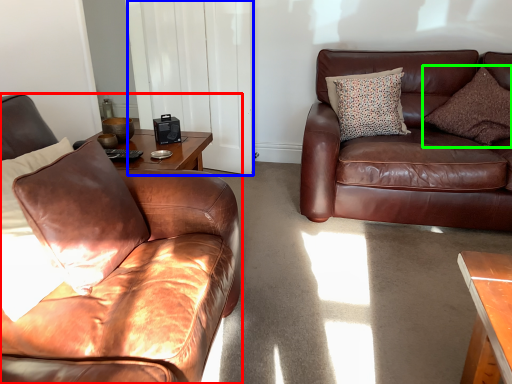
Question: Estimate the real-world distances between objects in this image. Which object is closer to studio couch (highlighted by a red box), glass door (highlighted by a blue box) or pillow (highlighted by a green box)?

Choices:
 (A) glass door
 (B) pillow

Answer: (A)